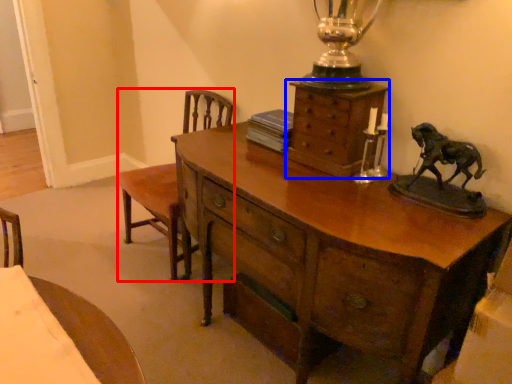
Question: Which object appears closest to the camera in this image, armchair (highlighted by a red box) or chest of drawers (highlighted by a blue box)?

Choices:
 (A) armchair
 (B) chest of drawers

Answer: (B)